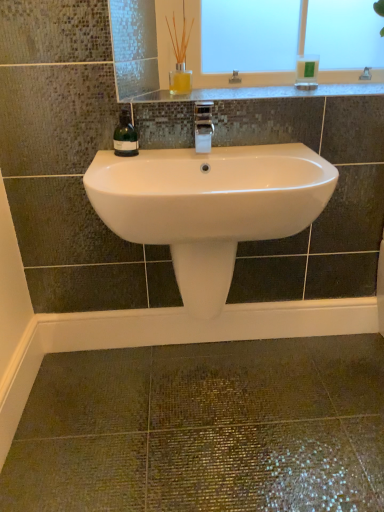
Question: From the image's perspective, relative to translucent glass vase at upper center, is granite countertop at upper center above or below?

Choices:
 (A) below
 (B) above

Answer: (A)

Question: Which is correct: granite countertop at upper center is inside translucent glass vase at upper center, or outside of it?

Choices:
 (A) outside
 (B) inside

Answer: (A)

Question: Which of these objects is positioned farthest from the granite countertop at upper center?

Choices:
 (A) green glass bottle at left
 (B) white glossy sink at center
 (C) white ceramic faucet at center
 (D) green plastic soap dispenser at upper right
 (E) translucent glass vase at upper center

Answer: (E)

Question: Which object is the farthest from the translucent glass vase at upper center?

Choices:
 (A) green glass bottle at left
 (B) white glossy sink at center
 (C) white ceramic faucet at center
 (D) granite countertop at upper center
 (E) green plastic soap dispenser at upper right

Answer: (B)